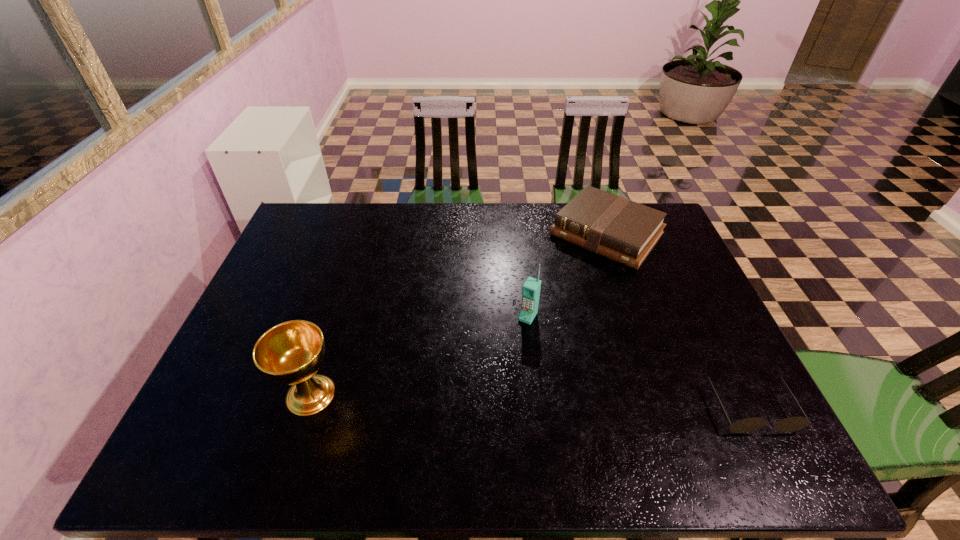
Where is `chalice`? chalice is located at coordinates (290, 353).

At what (x,y) coordinates should I click in order to perform the action: click on the shortest object. Please return your answer as a coordinate pair (x, y). Looking at the image, I should click on (791, 424).

This screenshot has height=540, width=960. What are the coordinates of `the second object from left to right` in the screenshot? It's located at [531, 288].

Locate an element on the screen. The image size is (960, 540). cellular telephone is located at coordinates (531, 288).

Where is `the third tallest object`? the third tallest object is located at coordinates (615, 227).

You are a GUI agent. You are given a task and a screenshot of the screen. Output one action in this format:
    pyautogui.click(x=<x>, y=<y>)
    Task: Click on the farthest object
    The width and height of the screenshot is (960, 540).
    Given the screenshot: What is the action you would take?
    pyautogui.click(x=615, y=227)

Image resolution: width=960 pixels, height=540 pixels. Identify the location of vacant area located 0.130m on the back of the leftmost object. (x=332, y=328).

The image size is (960, 540). Identify the location of vacant space located 0.160m on the keypad of the second farthest object. (497, 368).

The width and height of the screenshot is (960, 540). I want to click on free space located 0.290m on the keypad of the second farthest object, so click(472, 411).

The image size is (960, 540). What are the coordinates of `vacant area situated 0.260m on the keypad of the second farthest object` in the screenshot? It's located at (478, 401).